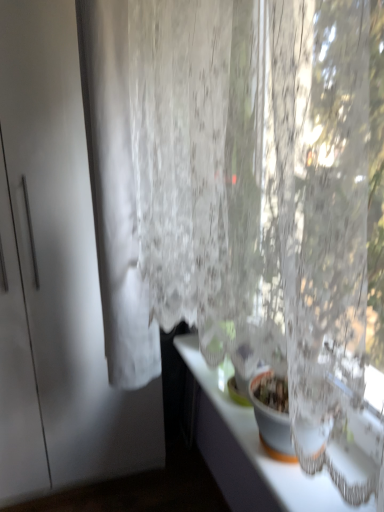
Measure the distance between white glossy counter top at lower right and camera.

white glossy counter top at lower right and camera are 4.06 feet apart from each other.

Locate an element on the screen. This screenshot has height=512, width=384. white matte screen door at left is located at coordinates (69, 260).

From the image's perspective, which one is positioned lower, white sheer curtain at left or white glossy counter top at lower right?

white glossy counter top at lower right is shown below in the image.

In terms of height, does white sheer curtain at left look taller or shorter compared to white glossy counter top at lower right?

white sheer curtain at left is taller than white glossy counter top at lower right.

Does point (135, 330) come closer to viewer compared to point (320, 495)?

No, it is not.

Is white sheer curtain at left touching white glossy counter top at lower right?

white sheer curtain at left and white glossy counter top at lower right are clearly separated.

Which object is positioned more to the right, white sheer curtain at left or white matte screen door at left?

Positioned to the right is white sheer curtain at left.

In the scene shown: Is white sheer curtain at left further to the viewer compared to white matte screen door at left?

No, it is not.

Can you confirm if white sheer curtain at left is shorter than white matte screen door at left?

Correct, white sheer curtain at left is not as tall as white matte screen door at left.

Considering the positions of points (119, 57) and (44, 394), is point (119, 57) closer to camera compared to point (44, 394)?

Yes, it is in front of point (44, 394).

Can you see white glossy counter top at lower right touching white sheer curtain at left?

No.

Is white sheer curtain at left completely or partially inside white glossy counter top at lower right?

No, white sheer curtain at left is not surrounded by white glossy counter top at lower right.

Does white glossy counter top at lower right have a lesser height compared to white sheer curtain at left?

Yes.

From the image's perspective, would you say white glossy counter top at lower right is shown under white sheer curtain at left?

Yes, from the image's perspective, white glossy counter top at lower right is beneath white sheer curtain at left.

Can you confirm if white glossy counter top at lower right is shorter than white matte screen door at left?

Indeed, white glossy counter top at lower right has a lesser height compared to white matte screen door at left.

Does white glossy counter top at lower right have a smaller size compared to white matte screen door at left?

Yes, white glossy counter top at lower right is smaller than white matte screen door at left.

From the image's perspective, which one is positioned lower, white glossy counter top at lower right or white matte screen door at left?

From the image's view, white glossy counter top at lower right is below.

From a real-world perspective, is white glossy counter top at lower right beneath white matte screen door at left?

Correct, in the physical world, white glossy counter top at lower right is lower than white matte screen door at left.

Identify the location of screen door that appears on the left of white glossy counter top at lower right. (69, 260).

Considering the relative sizes of white matte screen door at left and white glossy counter top at lower right in the image provided, is white matte screen door at left bigger than white glossy counter top at lower right?

Yes.

Does white matte screen door at left turn towards white glossy counter top at lower right?

Yes, white matte screen door at left faces towards white glossy counter top at lower right.

Identify the location of curtain on the right side of white matte screen door at left. (115, 193).

How much distance is there between white matte screen door at left and white sheer curtain at left?

white matte screen door at left and white sheer curtain at left are 10.15 inches apart from each other.

How many degrees apart are the facing directions of white matte screen door at left and white sheer curtain at left?

90 degrees separate the facing orientations of white matte screen door at left and white sheer curtain at left.

Does white matte screen door at left have a lesser height compared to white sheer curtain at left?

In fact, white matte screen door at left may be taller than white sheer curtain at left.

The width and height of the screenshot is (384, 512). Find the location of `counter top on the right of white sheer curtain at left`. counter top on the right of white sheer curtain at left is located at coordinates (248, 449).

Find the location of a particular element. This screenshot has height=512, width=384. curtain that is above the white matte screen door at left (from a real-world perspective) is located at coordinates (115, 193).

Based on their spatial positions, is white sheer curtain at left or white glossy counter top at lower right closer to white matte screen door at left?

Among the two, white sheer curtain at left is located nearer to white matte screen door at left.

In the scene shown: Based on their spatial positions, is white sheer curtain at left or white matte screen door at left further from white glossy counter top at lower right?

Based on the image, white sheer curtain at left appears to be further to white glossy counter top at lower right.

From the image, which object appears to be farther from white sheer curtain at left, white matte screen door at left or white glossy counter top at lower right?

white glossy counter top at lower right is positioned further to the anchor white sheer curtain at left.

Considering their positions, is white glossy counter top at lower right positioned further to white matte screen door at left than white sheer curtain at left?

white glossy counter top at lower right lies further to white matte screen door at left than the other object.

In the scene shown: From the image, which object appears to be farther from white sheer curtain at left, white glossy counter top at lower right or white matte screen door at left?

Based on the image, white glossy counter top at lower right appears to be further to white sheer curtain at left.

Estimate the real-world distances between objects in this image. Which object is further from white glossy counter top at lower right, white matte screen door at left or white sheer curtain at left?

Based on the image, white sheer curtain at left appears to be further to white glossy counter top at lower right.

I want to click on curtain between white matte screen door at left and white glossy counter top at lower right from left to right, so click(x=115, y=193).